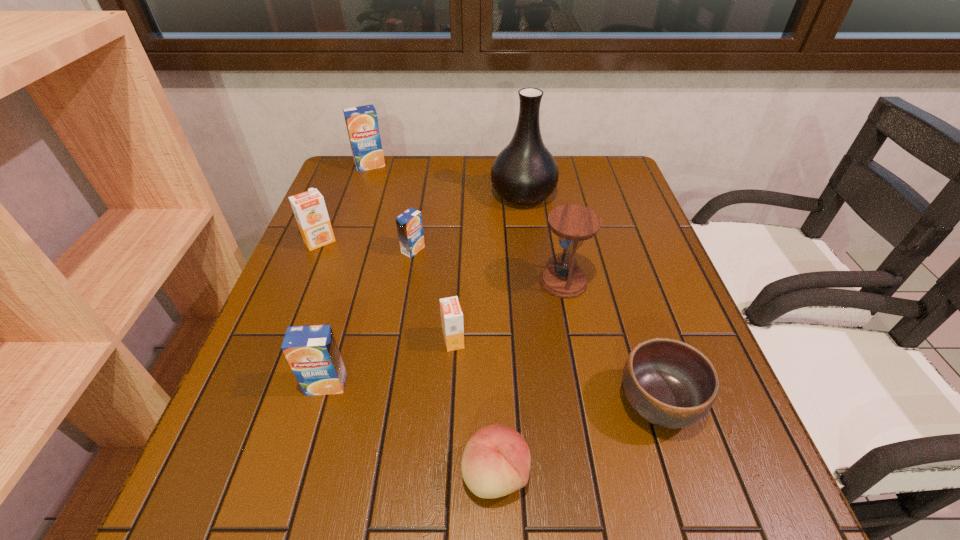
Identify the location of vacant point that satisfies the following two spatial constraints: 1. on the back side of the peach; 2. on the left side of the vase. This screenshot has height=540, width=960. (489, 194).

Where is `vacant space that satisfies the following two spatial constraints: 1. on the back side of the tallest object; 2. on the right side of the nearest orange juice`? The width and height of the screenshot is (960, 540). vacant space that satisfies the following two spatial constraints: 1. on the back side of the tallest object; 2. on the right side of the nearest orange juice is located at coordinates (381, 194).

Locate an element on the screen. The image size is (960, 540). free space that satisfies the following two spatial constraints: 1. on the front side of the bowl; 2. on the left side of the nearer orange orange juice is located at coordinates (450, 403).